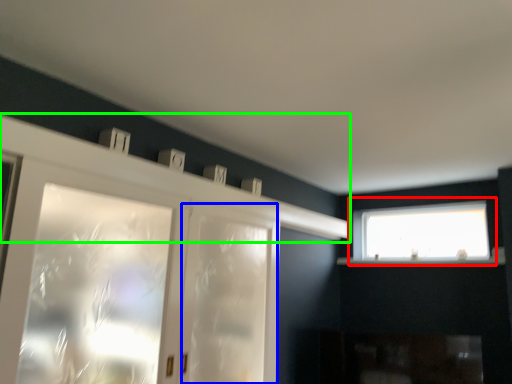
Question: Estimate the real-world distances between objects in this image. Which object is closer to window (highlighted by a red box), screen door (highlighted by a blue box) or mantle (highlighted by a green box)?

Choices:
 (A) screen door
 (B) mantle

Answer: (B)